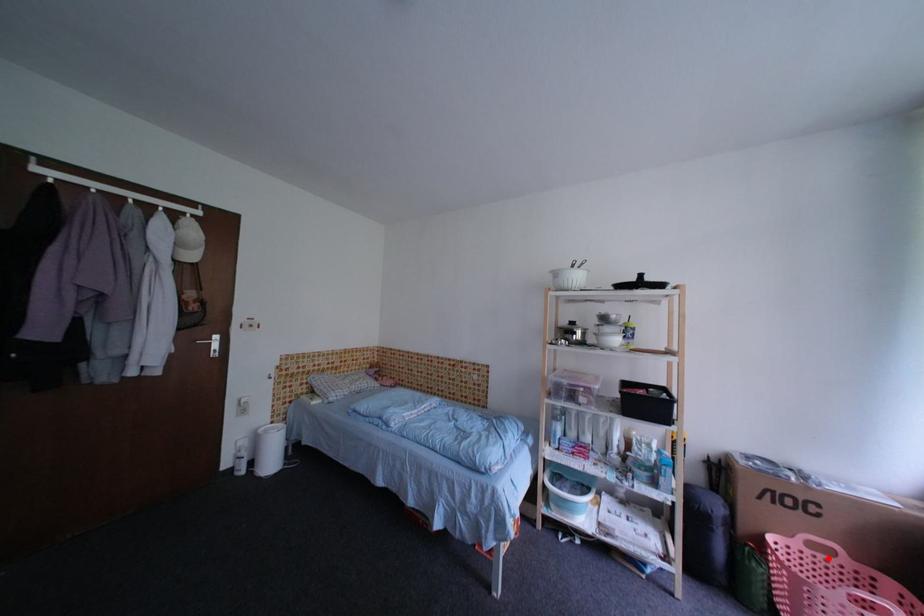
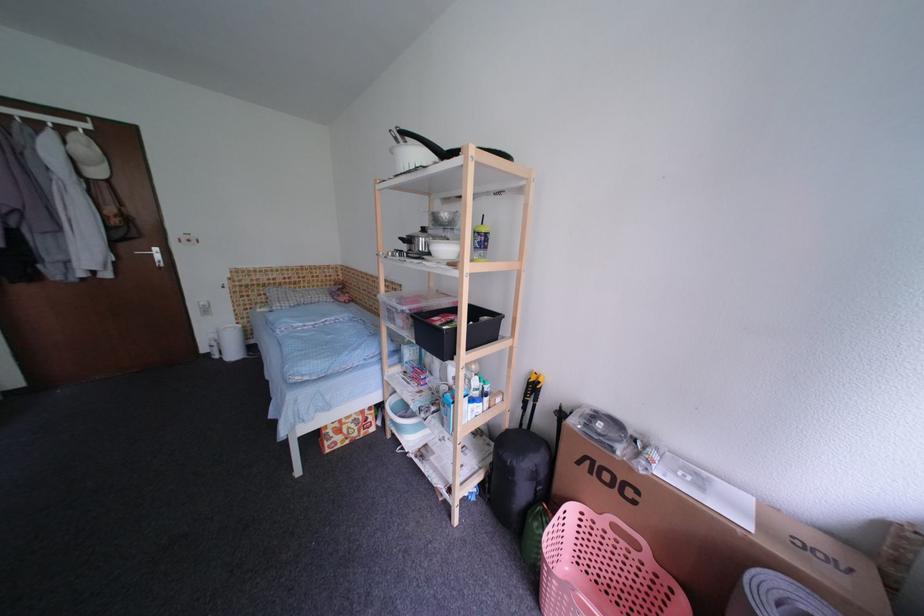
Question: A red point is marked in image1. In image2, is the corresponding 3D point closer to the camera or farther? Reply with the corresponding letter.

Choices:
 (A) The corresponding 3D point is closer.
 (B) The corresponding 3D point is farther.

Answer: (B)